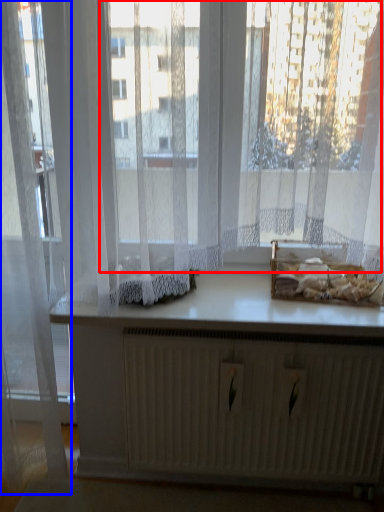
Question: Which of the following is the closest to the observer, bay window (highlighted by a red box) or curtain (highlighted by a blue box)?

Choices:
 (A) bay window
 (B) curtain

Answer: (A)